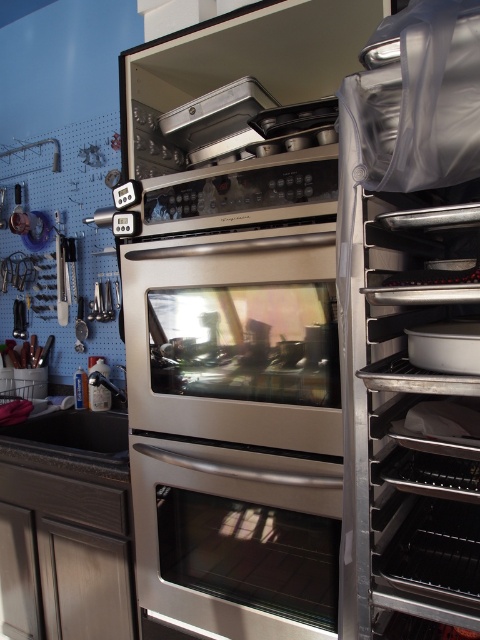
Question: Considering the real-world distances, which object is closest to the silver metallic baking tray at right?

Choices:
 (A) satin stainless steel oven at center
 (B) black matte sink at lower left
 (C) metallic silver exhaust hood at upper center

Answer: (A)

Question: Can you confirm if satin stainless steel oven at center is positioned to the right of metallic silver exhaust hood at upper center?

Choices:
 (A) yes
 (B) no

Answer: (A)

Question: Is satin stainless steel oven at center to the left of metallic silver exhaust hood at upper center from the viewer's perspective?

Choices:
 (A) no
 (B) yes

Answer: (A)

Question: Which of the following is the closest to the observer?

Choices:
 (A) (10, 436)
 (B) (470, 496)
 (C) (136, 579)
 (D) (254, 92)

Answer: (B)

Question: Is satin stainless steel oven at center positioned behind black matte sink at lower left?

Choices:
 (A) yes
 (B) no

Answer: (B)

Question: Which point is farther to the camera?

Choices:
 (A) metallic silver exhaust hood at upper center
 (B) satin stainless steel oven at center
 (C) black matte sink at lower left
 (D) silver metallic baking tray at right

Answer: (C)